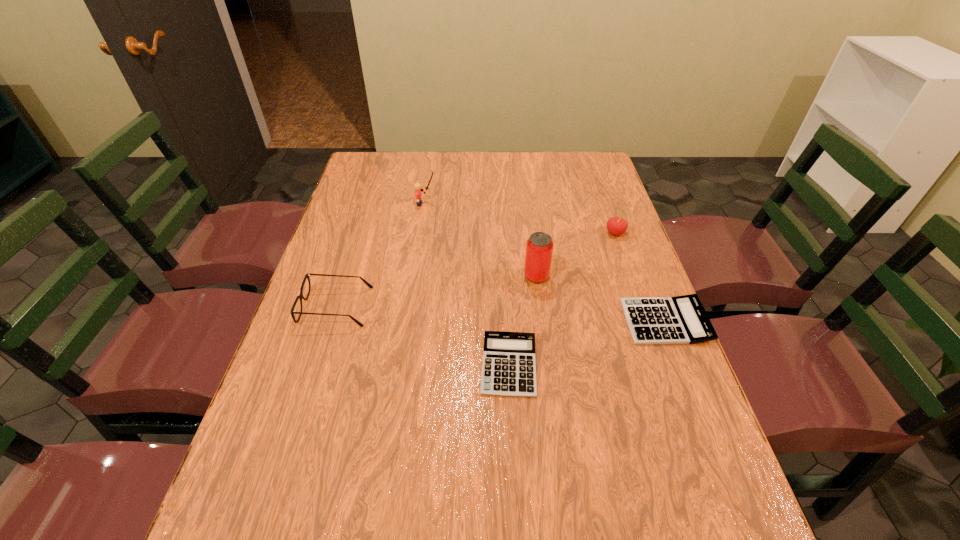
Locate an element on the screen. vacant space that satisfies the following two spatial constraints: 1. with the lenses facing outward on the third shortest object; 2. on the right side of the shorter calculator is located at coordinates (318, 365).

Locate an element on the screen. The height and width of the screenshot is (540, 960). free space that satisfies the following two spatial constraints: 1. on the front-facing side of the Lego; 2. on the right side of the taller calculator is located at coordinates tap(408, 322).

The height and width of the screenshot is (540, 960). I want to click on vacant space that satisfies the following two spatial constraints: 1. with the lenses facing outward on the shorter calculator; 2. on the right side of the spectacles, so click(x=318, y=365).

Identify the location of vacant space that satisfies the following two spatial constraints: 1. on the back side of the shorter calculator; 2. on the front-facing side of the Lego. This screenshot has width=960, height=540. (499, 204).

The image size is (960, 540). Find the location of `free location that satisfies the following two spatial constraints: 1. on the back side of the shortest object; 2. on the front-facing side of the farthest object`. free location that satisfies the following two spatial constraints: 1. on the back side of the shortest object; 2. on the front-facing side of the farthest object is located at coordinates (499, 204).

Locate an element on the screen. The height and width of the screenshot is (540, 960). free spot that satisfies the following two spatial constraints: 1. on the front-facing side of the tallest object; 2. on the right side of the farthest object is located at coordinates (415, 276).